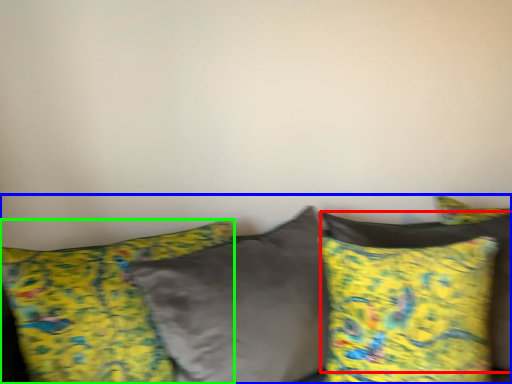
Question: Which is farther away from pillow (highlighted by a red box)? studio couch (highlighted by a blue box) or pillow (highlighted by a green box)?

Choices:
 (A) studio couch
 (B) pillow

Answer: (B)